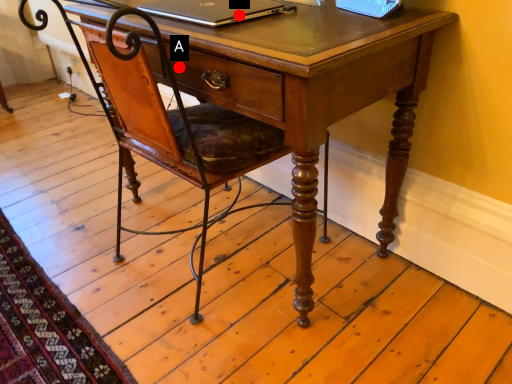
Question: Two points are circled on the image, labeled by A and B beside each circle. Which point is closer to the camera?

Choices:
 (A) A is closer
 (B) B is closer

Answer: (B)